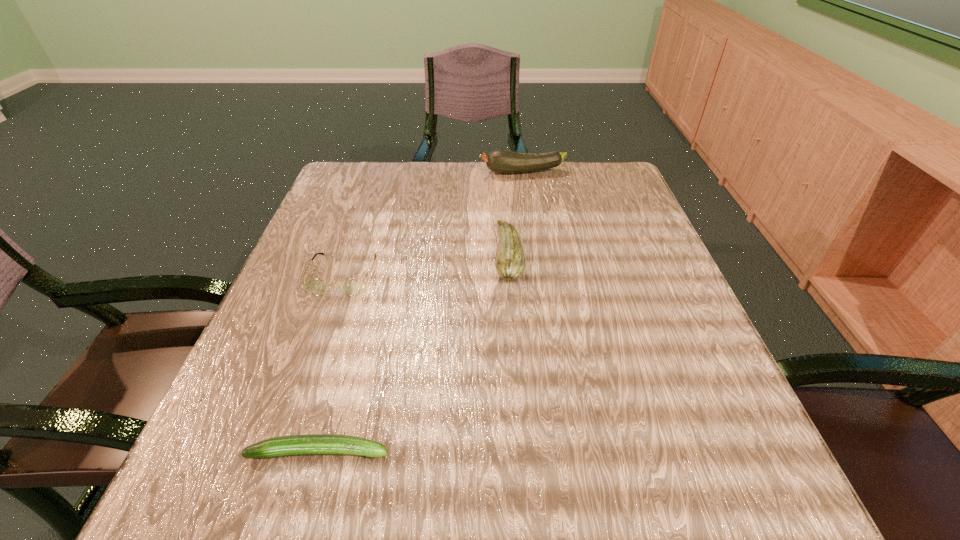
The width and height of the screenshot is (960, 540). In the image, there is a desktop. Identify the location of free space at the far edge. (529, 176).

Find the location of `vacant region at the near edge of the desktop`. vacant region at the near edge of the desktop is located at coordinates (577, 507).

Identify the location of vacant point at the left edge. The height and width of the screenshot is (540, 960). (x=352, y=223).

Find the location of a particular element. vacant space at the right edge of the desktop is located at coordinates pyautogui.click(x=590, y=245).

Where is `free space at the far left corner of the desktop`? The width and height of the screenshot is (960, 540). free space at the far left corner of the desktop is located at coordinates (340, 201).

This screenshot has height=540, width=960. What are the coordinates of `free space at the near left corner of the desktop` in the screenshot? It's located at (188, 487).

Where is `vacant space at the far right corner of the desktop`? Image resolution: width=960 pixels, height=540 pixels. vacant space at the far right corner of the desktop is located at coordinates coord(575,208).

Find the location of a particular element. The height and width of the screenshot is (540, 960). free space between the second farthest zucchini and the shortest object is located at coordinates (414, 353).

You are a GUI agent. You are given a task and a screenshot of the screen. Output one action in this format:
    pyautogui.click(x=<x>, y=<y>)
    Task: Click on the vacant area that lies between the second nearest zucchini and the leftmost zucchini
    The width and height of the screenshot is (960, 540).
    Given the screenshot: What is the action you would take?
    pyautogui.click(x=414, y=353)

Image resolution: width=960 pixels, height=540 pixels. Find the location of `vacant space that is in between the farthest object and the second shortest object`. vacant space that is in between the farthest object and the second shortest object is located at coordinates point(433,223).